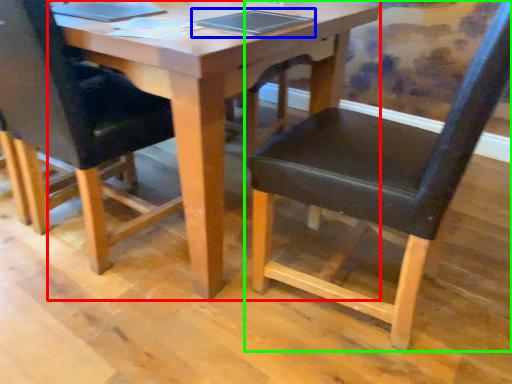
Question: Which is nearer to the table (highlighted by a red box)? notebook (highlighted by a blue box) or chair (highlighted by a green box).

Choices:
 (A) notebook
 (B) chair

Answer: (A)